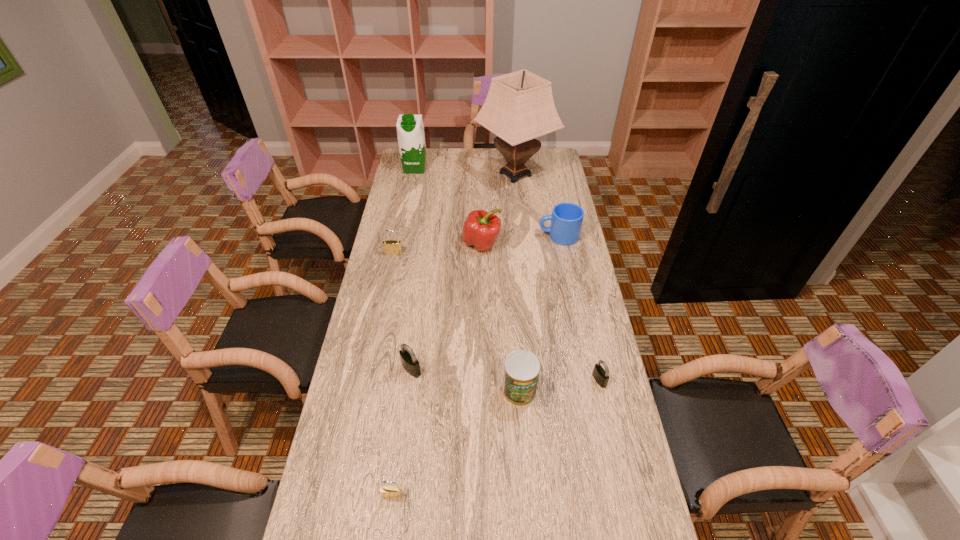
Identify the location of free space that satisfies the following two spatial constraints: 1. on the front side of the rightmost padlock; 2. on the right side of the bigger black padlock. Image resolution: width=960 pixels, height=540 pixels. (410, 380).